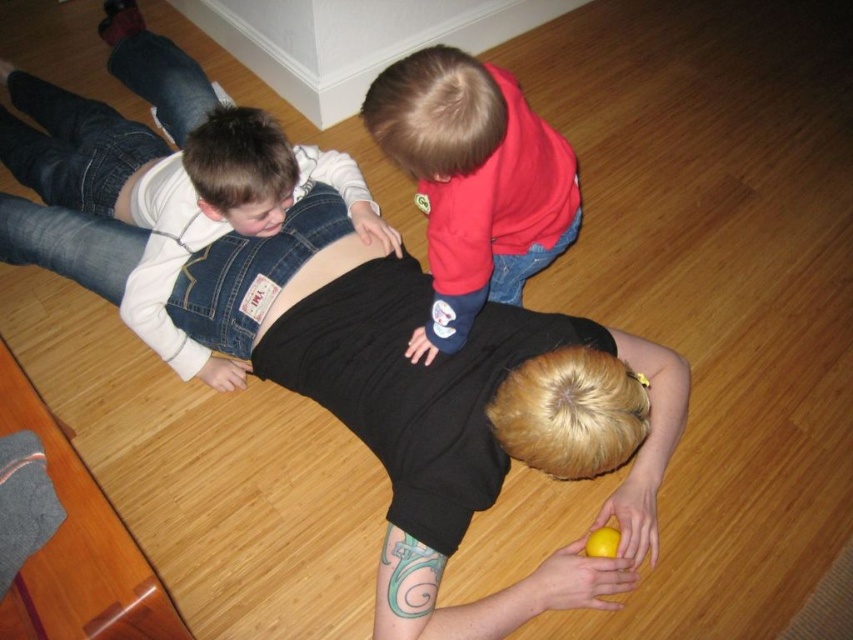
In the scene described, where is the denim overalls at upper left located in terms of coordinates?

The denim overalls at upper left is located at coordinates point (170,179).

You are a photographer trying to capture a candid shot of the scene. You want to ensure that both the denim overalls at upper left and the denim at center are in the frame. Based on their positions, which direction should you move your camera to include both objects?

Since the denim overalls at upper left is to the left of denim at center, you should move your camera to the left to include both objects in the frame.